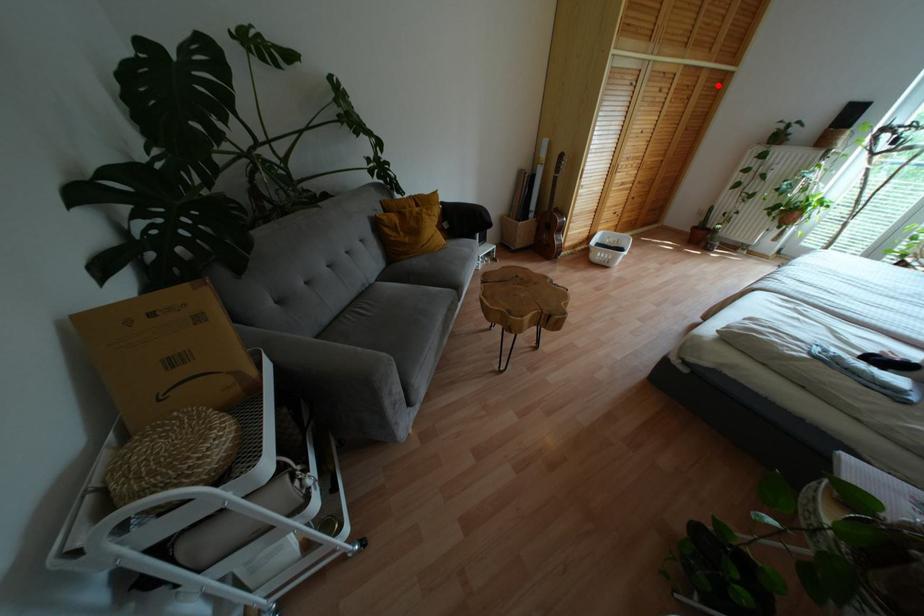
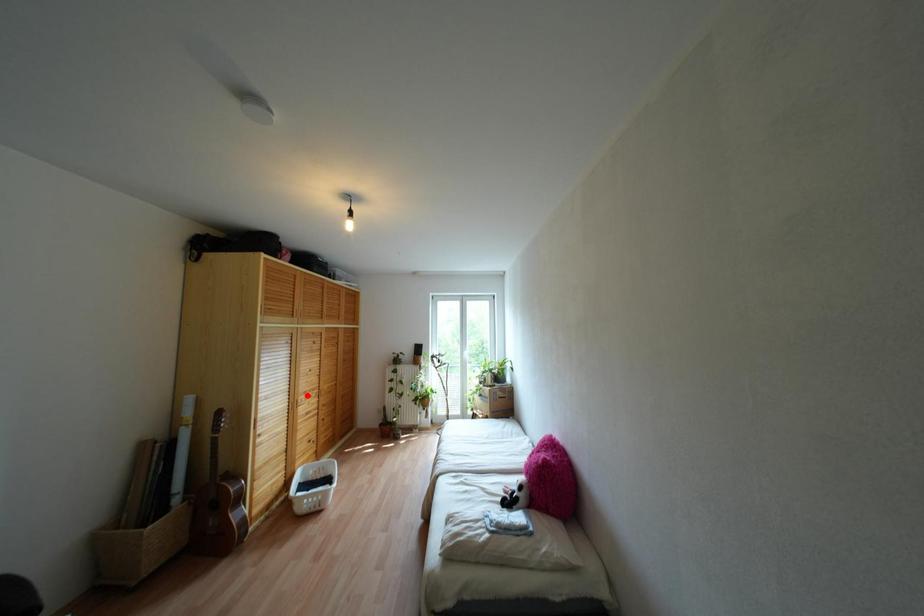
I am providing you with two images of the same scene from different viewpoints. A red point is marked on the first image and another point is marked on the second image. Are the points marked in image1 and image2 representing the same 3D position?

No